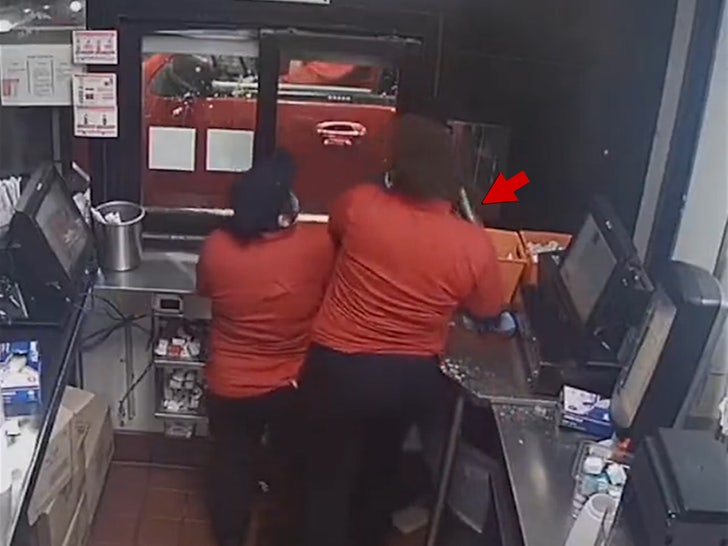
The image size is (728, 546). Identify the location of handle. (347, 135).